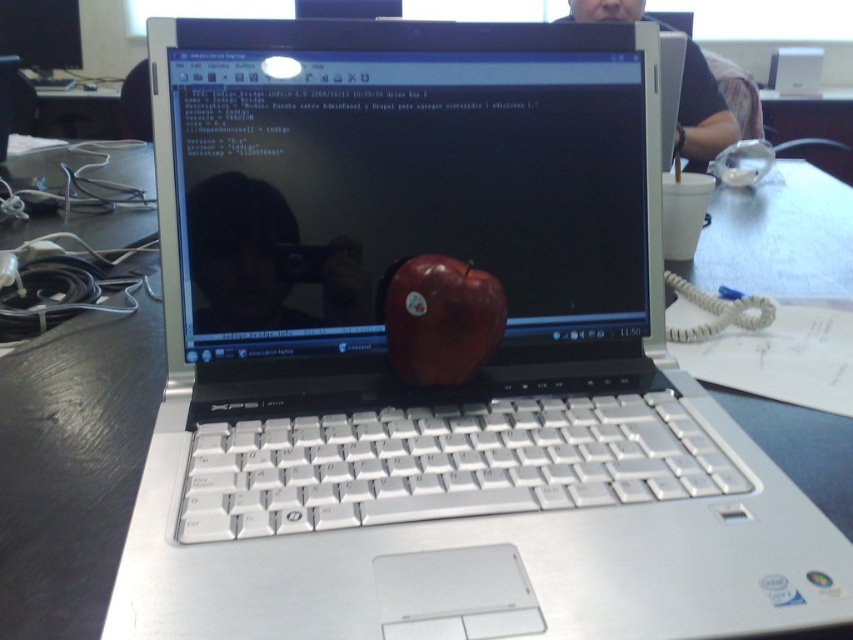
Which is in front, point (637, 212) or point (422, 304)?

Point (422, 304) is more forward.

Is glossy plastic computer screen at center behind shiny red apple at center?

Yes, it is behind shiny red apple at center.

The height and width of the screenshot is (640, 853). Identify the location of glossy plastic computer screen at center. (402, 179).

Find the location of a particular element. glossy plastic computer screen at center is located at coordinates (402, 179).

Describe the element at coordinates (402, 179) in the screenshot. I see `glossy plastic computer screen at center` at that location.

Between point (564, 330) and point (685, 76), which one is positioned behind?

The point (685, 76) is more distant.

Locate an element on the screen. The width and height of the screenshot is (853, 640). glossy plastic computer screen at center is located at coordinates (402, 179).

Can you confirm if shiny red apple at center is wider than matte black laptop at center?

No, shiny red apple at center is not wider than matte black laptop at center.

Does shiny red apple at center have a larger size compared to matte black laptop at center?

No.

Where is `shiny red apple at center`? shiny red apple at center is located at coordinates (439, 317).